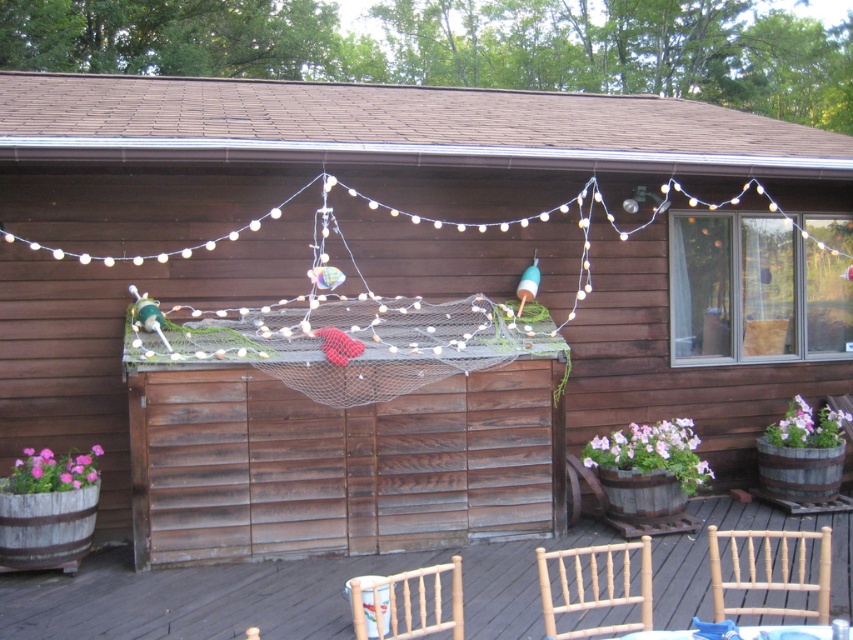
Looking at this image, you are a guest at the cabin and want to sit down at the table. Based on the scene, which object is shorter, the wooden chairs at lower center or the white plastic table at lower center?

The wooden chairs at lower center are shorter than the white plastic table at lower center according to the description.

You are standing on the wooden deck and looking at two points marked on the deck floor. The first point is at coordinate point (460, 593) and the second point is at coordinate point (720, 609). Which point is closer to you?

Point (460, 593) is closer to you than point (720, 609).